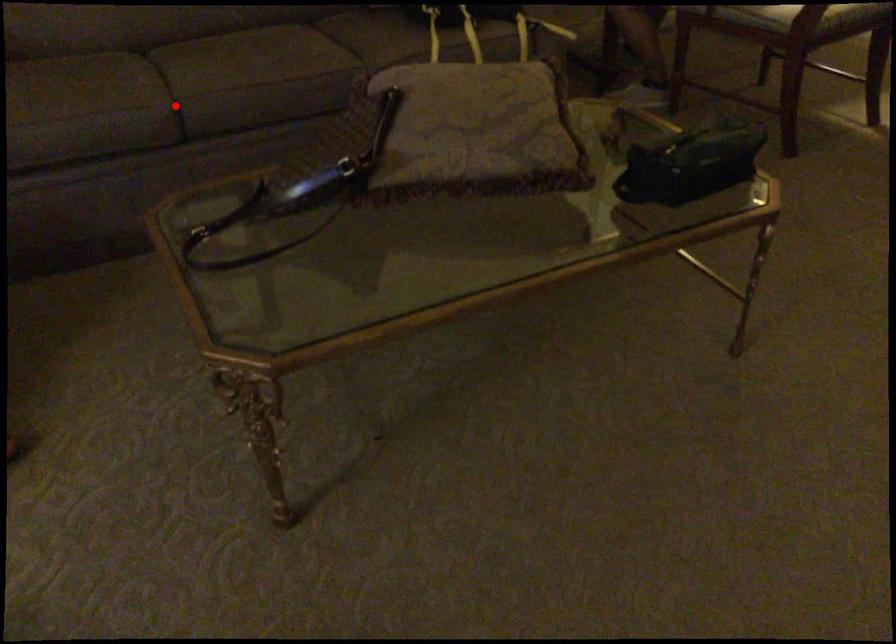
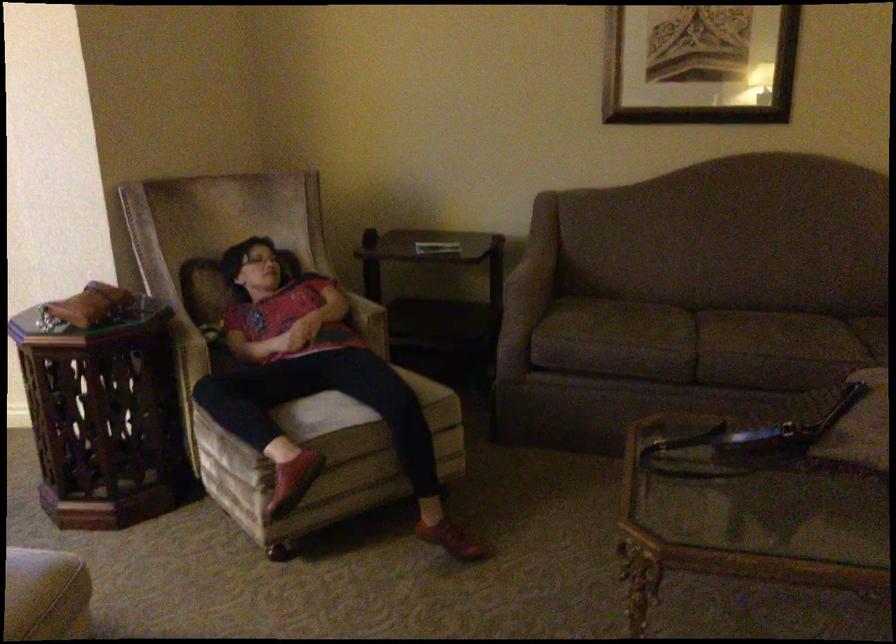
Question: I am providing you with two images of the same scene from different viewpoints. Image1 has a red point marked. In image2, the corresponding 3D location appears at what relative position? Reply with the corresponding letter.

Choices:
 (A) Closer
 (B) Farther

Answer: (B)